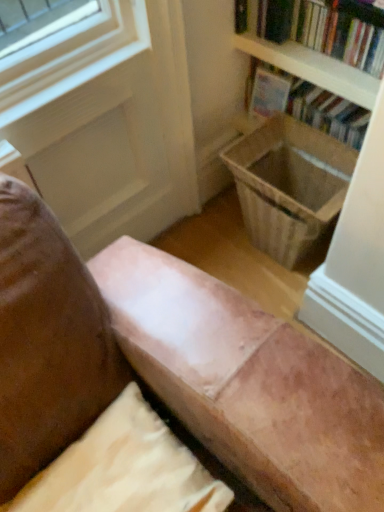
The width and height of the screenshot is (384, 512). I want to click on vacant location below hardcover book at upper right, which appears as the 2th book when viewed from the back (from a real-world perspective), so click(x=305, y=49).